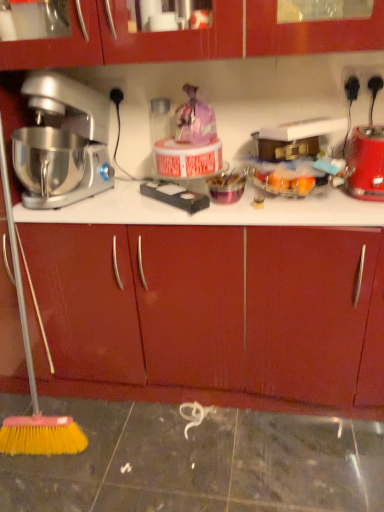
Question: In terms of size, does matte wood drawer at center appear bigger or smaller than red plastic blender at right?

Choices:
 (A) big
 (B) small

Answer: (A)

Question: From a real-world perspective, is matte wood drawer at center above or below red plastic blender at right?

Choices:
 (A) above
 (B) below

Answer: (B)

Question: Which object is positioned closest to the matte wood drawer at center?

Choices:
 (A) red plastic blender at right
 (B) silver metallic mixer at left

Answer: (B)

Question: Estimate the real-world distances between objects in this image. Which object is closer to the matte wood drawer at center?

Choices:
 (A) red plastic blender at right
 (B) silver metallic mixer at left

Answer: (B)